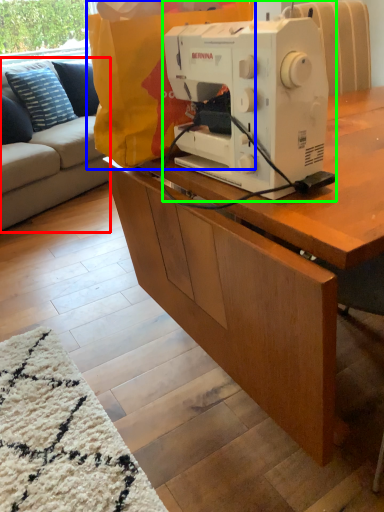
Question: Which is farther away from studio couch (highlighted by a red box)? paper bag (highlighted by a blue box) or sewing machine (highlighted by a green box)?

Choices:
 (A) paper bag
 (B) sewing machine

Answer: (B)